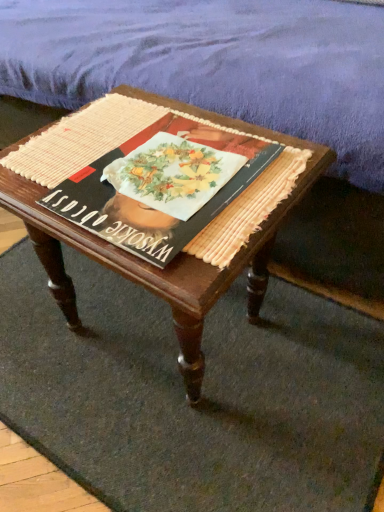
Question: Does matte black book at center appear on the right side of woven beige doormat at center?

Choices:
 (A) yes
 (B) no

Answer: (A)

Question: Considering the relative sizes of matte black book at center and woven beige doormat at center in the image provided, is matte black book at center smaller than woven beige doormat at center?

Choices:
 (A) yes
 (B) no

Answer: (A)

Question: Is the position of matte black book at center less distant than that of woven beige doormat at center?

Choices:
 (A) no
 (B) yes

Answer: (B)

Question: Can you confirm if matte black book at center is bigger than woven beige doormat at center?

Choices:
 (A) yes
 (B) no

Answer: (B)

Question: From the image's perspective, is matte black book at center located above woven beige doormat at center?

Choices:
 (A) yes
 (B) no

Answer: (A)

Question: Considering the relative sizes of matte black book at center and woven beige doormat at center in the image provided, is matte black book at center wider than woven beige doormat at center?

Choices:
 (A) no
 (B) yes

Answer: (A)

Question: Is woven beige doormat at center facing away from wooden coffee table at center?

Choices:
 (A) no
 (B) yes

Answer: (A)

Question: Considering the relative positions of woven beige doormat at center and wooden coffee table at center in the image provided, is woven beige doormat at center behind wooden coffee table at center?

Choices:
 (A) yes
 (B) no

Answer: (A)

Question: Does woven beige doormat at center have a larger size compared to wooden coffee table at center?

Choices:
 (A) no
 (B) yes

Answer: (A)

Question: Does woven beige doormat at center have a smaller size compared to wooden coffee table at center?

Choices:
 (A) yes
 (B) no

Answer: (A)

Question: Is there a large distance between woven beige doormat at center and wooden coffee table at center?

Choices:
 (A) yes
 (B) no

Answer: (B)

Question: Is woven beige doormat at center wider than wooden coffee table at center?

Choices:
 (A) yes
 (B) no

Answer: (A)

Question: Considering the relative sizes of wooden coffee table at center and purple fabric mattress at upper center in the image provided, is wooden coffee table at center taller than purple fabric mattress at upper center?

Choices:
 (A) no
 (B) yes

Answer: (A)